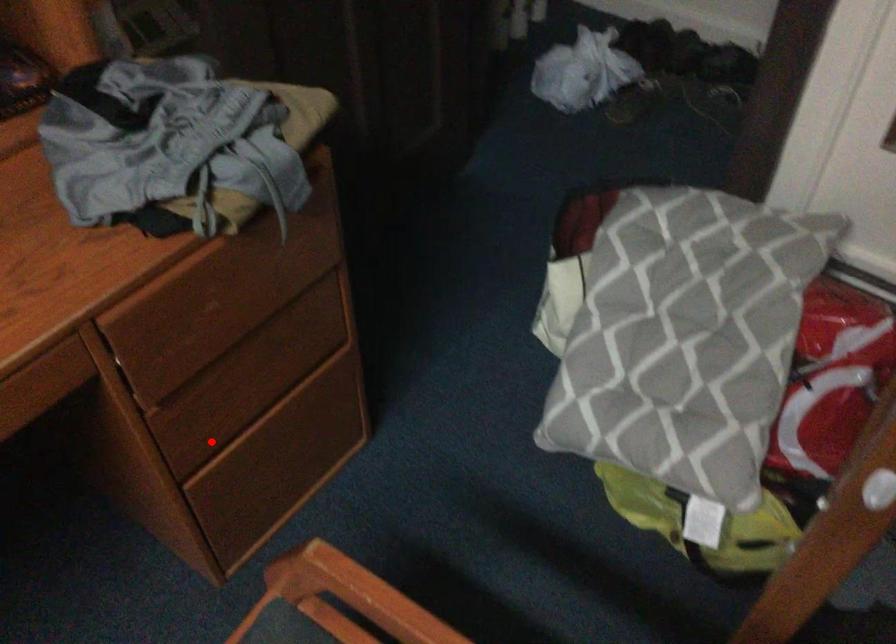
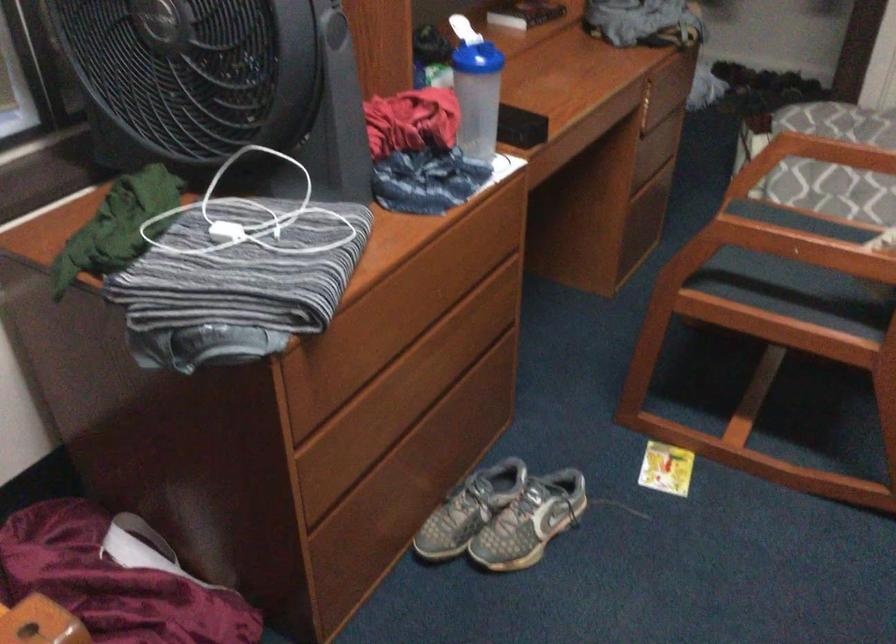
Question: A red point is marked in image1. In image2, is the corresponding 3D point closer to the camera or farther? Reply with the corresponding letter.

Choices:
 (A) The corresponding 3D point is closer.
 (B) The corresponding 3D point is farther.

Answer: (B)